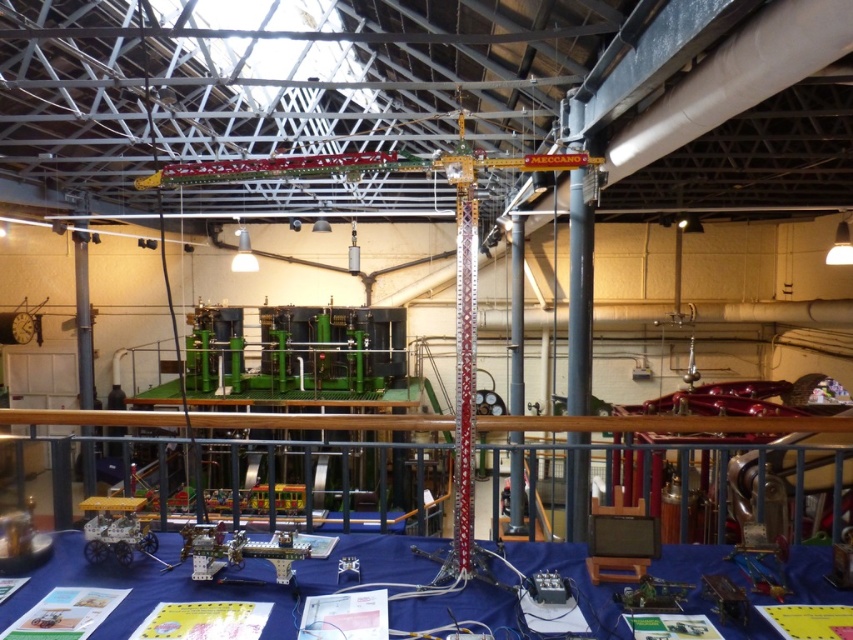
Question: Considering the real-world distances, which object is farthest from the blue fabric table at lower center?

Choices:
 (A) metallic red crane at center
 (B) metallic gray pole at center

Answer: (B)

Question: Is blue fabric table at lower center wider than metallic red crane at center?

Choices:
 (A) no
 (B) yes

Answer: (B)

Question: Observing the image, what is the correct spatial positioning of metallic red crane at center in reference to metallic gray pole at center?

Choices:
 (A) right
 (B) left

Answer: (B)

Question: Which object is closer to the camera taking this photo?

Choices:
 (A) metallic gray pole at center
 (B) metallic red crane at center

Answer: (B)

Question: Does metallic red crane at center have a lesser width compared to metallic gray pole at center?

Choices:
 (A) yes
 (B) no

Answer: (B)

Question: Which object appears farthest from the camera in this image?

Choices:
 (A) blue fabric table at lower center
 (B) metallic gray pole at center

Answer: (B)